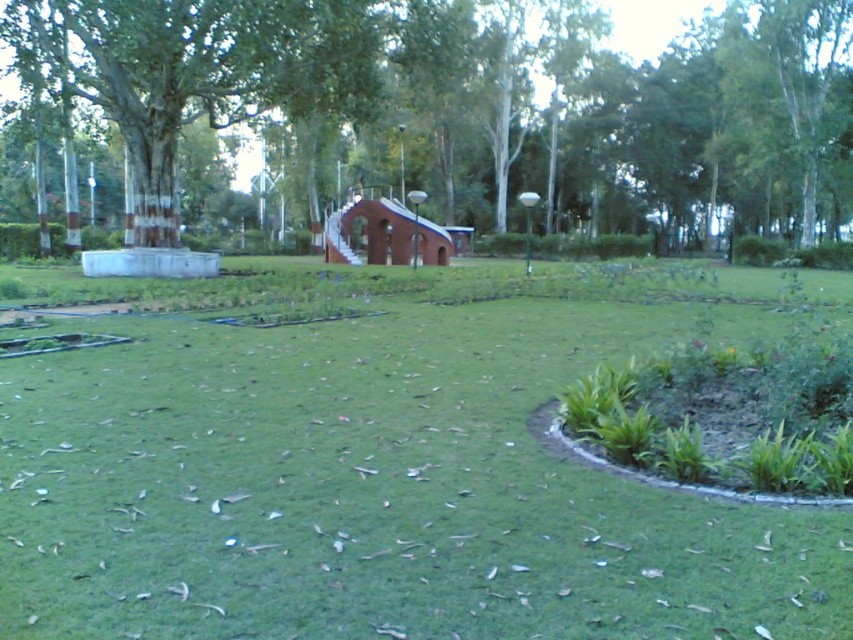
Question: Which object appears farthest from the camera in this image?

Choices:
 (A) green grass at center
 (B) brick/stone hut at center

Answer: (B)

Question: Which object appears farthest from the camera in this image?

Choices:
 (A) brick/stone hut at center
 (B) green grass at center
 (C) green leafy tree at upper left

Answer: (A)

Question: Does green leafy tree at upper left appear over brick/stone hut at center?

Choices:
 (A) no
 (B) yes

Answer: (B)

Question: Does green grass at center appear on the left side of green leafy tree at upper left?

Choices:
 (A) yes
 (B) no

Answer: (A)

Question: Does green leafy tree at upper left appear on the right side of brick/stone hut at center?

Choices:
 (A) yes
 (B) no

Answer: (A)

Question: Which point is farther to the camera?

Choices:
 (A) (689, 81)
 (B) (306, 394)

Answer: (A)